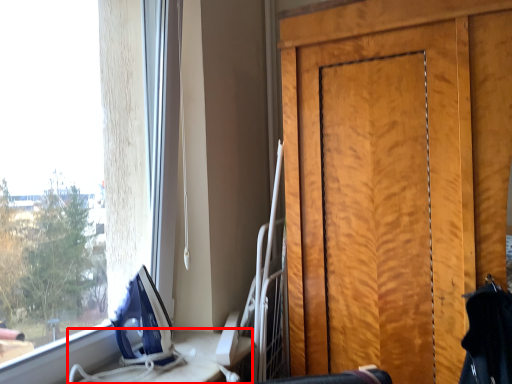
Question: Observing the image, what is the correct spatial positioning of table (annotated by the red box) in reference to door?

Choices:
 (A) left
 (B) right

Answer: (A)